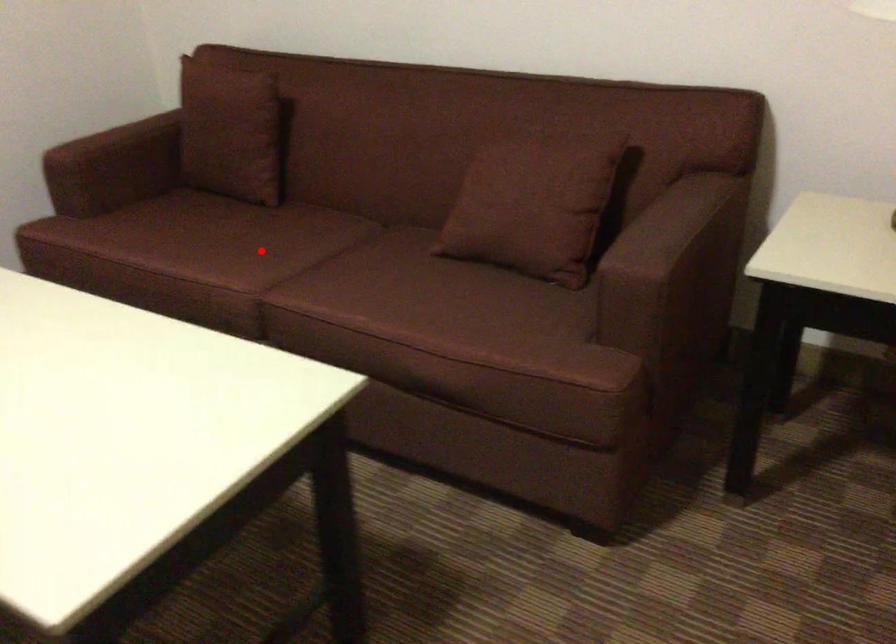
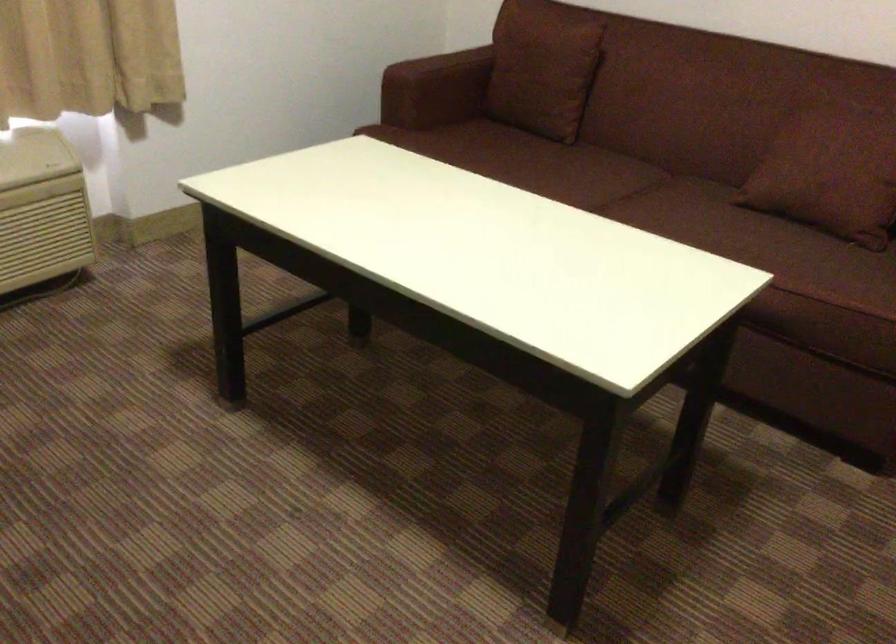
Find the pixel in the second image that matches the highlighted location in the first image.

(574, 176)